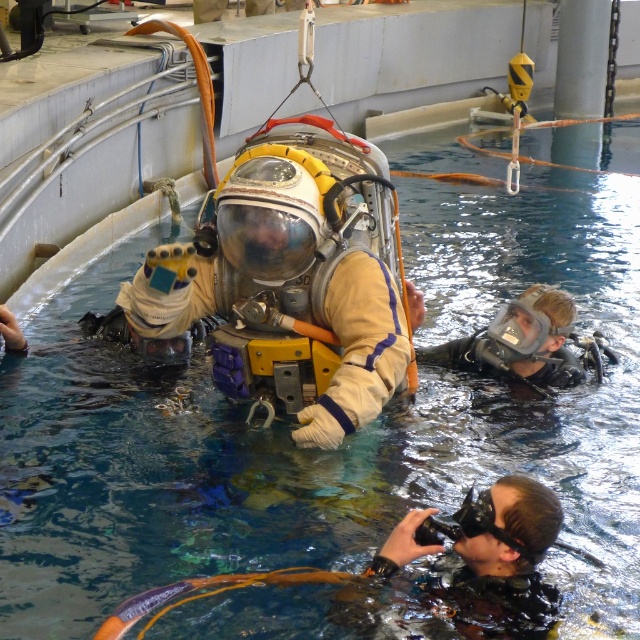
Question: Among these objects, which one is nearest to the camera?

Choices:
 (A) black rubber camera at lower right
 (B) clear plastic mask at lower right

Answer: (A)

Question: Does black rubber camera at lower right have a smaller size compared to clear plastic mask at lower right?

Choices:
 (A) no
 (B) yes

Answer: (B)

Question: Can you confirm if black rubber camera at lower right is bigger than clear plastic mask at lower right?

Choices:
 (A) yes
 (B) no

Answer: (B)

Question: Which point appears farthest from the camera in this image?

Choices:
 (A) (467, 612)
 (B) (563, 339)

Answer: (B)

Question: Can you confirm if black rubber camera at lower right is wider than clear plastic mask at lower right?

Choices:
 (A) no
 (B) yes

Answer: (A)